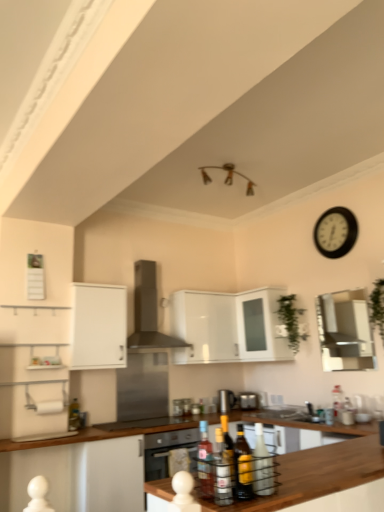
Question: From the image's perspective, is translucent glass bottle at center, which appears as the second bottle when viewed from the back, above or below translucent glass bottles at center, which is the first bottle in front-to-back order?

Choices:
 (A) below
 (B) above

Answer: (B)

Question: In the image, is translucent glass bottle at center, which appears as the second bottle when viewed from the back, positioned in front of or behind translucent glass bottles at center, positioned as the third bottle in left-to-right order?

Choices:
 (A) front
 (B) behind

Answer: (B)

Question: Which object is positioned closest to the translucent glass bottles at center, the fifth bottle viewed from the back?

Choices:
 (A) translucent glass bottle at center, placed as the second bottle when sorted from front to back
 (B) white glossy cabinet at upper center, which is counted as the 1th cabinetry, starting from the right
 (C) satin black exhaust hood at center
 (D) wooden at center, acting as the 2th countertop starting from the front
 (E) green leafy plant at right, which appears as the 2th plant when viewed from the back

Answer: (A)

Question: Estimate the real-world distances between objects in this image. Which object is farther from the green leafy plant at upper center, acting as the first plant starting from the left?

Choices:
 (A) wooden at center, which is the first countertop from front to back
 (B) translucent glass bottle at lower left, the 5th bottle in the right-to-left sequence
 (C) stainless steel range hood at center, acting as the first appliance starting from the left
 (D) satin silver toaster at center, the 2th appliance viewed from the right
 (E) translucent glass bottle at center, positioned as the 3th bottle in back-to-front order

Answer: (E)